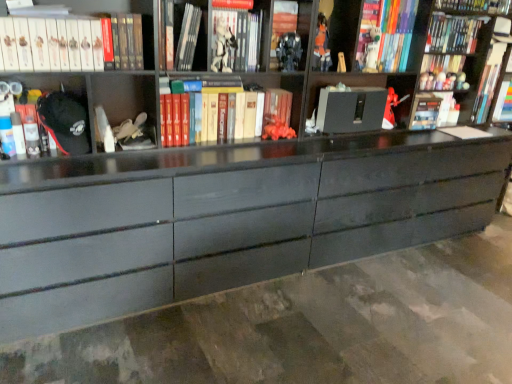
Measure the distance between point (440, 94) and camera.

They are 2.82 meters apart.

The width and height of the screenshot is (512, 384). Describe the element at coordinates (180, 35) in the screenshot. I see `hardcover book at upper left, marked as the 3th book in a left-to-right arrangement` at that location.

Looking at this image, measure the distance between point (118,21) and camera.

Point (118,21) and camera are 1.80 meters apart.

What do you see at coordinates (223, 49) in the screenshot?
I see `matte black figurine at upper center, marked as the first toy in a front-to-back arrangement` at bounding box center [223, 49].

Measure the distance between point (222,134) and camera.

A distance of 7.32 feet exists between point (222,134) and camera.

Describe the element at coordinates (426, 81) in the screenshot. This screenshot has width=512, height=384. I see `matte red figurine at upper right, which is the 5th toy from left to right` at that location.

At what (x,y) coordinates should I click in order to perform the action: click on black matte cabinet at center. Please return your answer as a coordinate pair (x, y). The width and height of the screenshot is (512, 384). Looking at the image, I should click on (361, 101).

Is hardcover book at upper left, arranged as the second book when viewed from the left, positioned beyond the bounds of hardcover book at upper center, which is the 5th book from right to left?

Indeed, hardcover book at upper left, arranged as the second book when viewed from the left, is completely outside hardcover book at upper center, which is the 5th book from right to left.

Can you confirm if hardcover book at upper left, arranged as the second book when viewed from the left, is positioned to the right of hardcover book at upper center, which is the 5th book from right to left?

No.

Based on the photo, is hardcover book at upper left, arranged as the second book when viewed from the left, positioned before hardcover book at upper center, which ranks as the 6th book in left-to-right order?

Yes, hardcover book at upper left, arranged as the second book when viewed from the left, is closer to the camera.

Are hardcover book at upper left, acting as the 9th book starting from the right, and hardcover book at upper center, which is the 5th book from right to left, beside each other?

hardcover book at upper left, acting as the 9th book starting from the right, is not next to hardcover book at upper center, which is the 5th book from right to left, and they're not touching.

From the image's perspective, which is above, matte red figurine at upper right, acting as the 7th book starting from the left, or hardcover books at center, which is counted as the 7th book, starting from the right?

From the image's view, matte red figurine at upper right, acting as the 7th book starting from the left, is above.

Is matte red figurine at upper right, the fourth book from the right, facing towards hardcover books at center, acting as the fourth book starting from the left?

No, matte red figurine at upper right, the fourth book from the right, is not oriented towards hardcover books at center, acting as the fourth book starting from the left.

Where is `the 3rd book behind the hardcover books at center, which is counted as the 7th book, starting from the right`? the 3rd book behind the hardcover books at center, which is counted as the 7th book, starting from the right is located at coordinates (434, 110).

Considering the relative sizes of matte red figurine at upper right, acting as the 7th book starting from the left, and hardcover books at center, acting as the fourth book starting from the left, in the image provided, is matte red figurine at upper right, acting as the 7th book starting from the left, wider than hardcover books at center, acting as the fourth book starting from the left,?

No.

From their relative heights in the image, would you say orange matte toy at center, the 3th toy viewed from the front, is taller or shorter than white matte book at upper left, marked as the tenth book in a right-to-left arrangement?

Considering their sizes, orange matte toy at center, the 3th toy viewed from the front, has less height than white matte book at upper left, marked as the tenth book in a right-to-left arrangement.

This screenshot has width=512, height=384. I want to click on the 3rd book above when counting from the orange matte toy at center, which appears as the third toy when viewed from the back (from the image's perspective), so click(54, 44).

Considering the sizes of objects orange matte toy at center, which appears as the third toy when viewed from the back, and white matte book at upper left, marked as the tenth book in a right-to-left arrangement, in the image provided, who is smaller, orange matte toy at center, which appears as the third toy when viewed from the back, or white matte book at upper left, marked as the tenth book in a right-to-left arrangement,?

orange matte toy at center, which appears as the third toy when viewed from the back, is smaller.

Is matte red figurine at upper right, acting as the 7th book starting from the left, a part of orange matte toy at center, which appears as the third toy when viewed from the back?

No.

Does point (288, 129) lie in front of point (455, 109)?

Yes, point (288, 129) is closer to viewer.

Does orange matte toy at center, which appears as the third toy when viewed from the back, have a smaller size compared to matte red figurine at upper right, the fourth book from the right?

Yes, orange matte toy at center, which appears as the third toy when viewed from the back, is smaller than matte red figurine at upper right, the fourth book from the right.

Is orange matte toy at center, the second toy in the left-to-right sequence, next to matte red figurine at upper right, the fourth book from the right, and touching it?

orange matte toy at center, the second toy in the left-to-right sequence, and matte red figurine at upper right, the fourth book from the right, are not in contact.

From the image's perspective, relative to hardcover book at upper right, the 3th book positioned from the right, is metallic silver robot at center, acting as the 4th toy starting from the back, above or below?

Clearly, from the image's perspective, metallic silver robot at center, acting as the 4th toy starting from the back, is below hardcover book at upper right, the 3th book positioned from the right.

Is metallic silver robot at center, acting as the 4th toy starting from the back, beside hardcover book at upper right, the 3th book positioned from the right?

No, metallic silver robot at center, acting as the 4th toy starting from the back, is not beside hardcover book at upper right, the 3th book positioned from the right.

Is metallic silver robot at center, which ranks as the third toy in right-to-left order, facing towards hardcover book at upper right, the 3th book positioned from the right?

No, metallic silver robot at center, which ranks as the third toy in right-to-left order, is not turned towards hardcover book at upper right, the 3th book positioned from the right.

Between orange matte toy at center, the fourth toy from the right, and matte red figurine at upper right, the 5th toy from the front, which one is positioned behind?

matte red figurine at upper right, the 5th toy from the front, is further from the camera.

Is orange matte toy at center, the second toy in the left-to-right sequence, inside or outside of matte red figurine at upper right, which is counted as the 1th toy, starting from the right?

orange matte toy at center, the second toy in the left-to-right sequence, is spatially situated outside matte red figurine at upper right, which is counted as the 1th toy, starting from the right.

Does orange matte toy at center, the 3th toy viewed from the front, turn towards matte red figurine at upper right, which is counted as the 1th toy, starting from the back?

No, orange matte toy at center, the 3th toy viewed from the front, does not turn towards matte red figurine at upper right, which is counted as the 1th toy, starting from the back.

Is orange matte toy at center, the fourth toy from the right, with matte red figurine at upper right, which is counted as the 1th toy, starting from the back?

They are not placed beside each other.

Is matte black desk at center completely or partially outside of metallic silver robot at center, acting as the 4th toy starting from the back?

Yes.

Could you tell me if matte black desk at center is facing metallic silver robot at center, which ranks as the third toy in right-to-left order?

Yes, matte black desk at center faces towards metallic silver robot at center, which ranks as the third toy in right-to-left order.

Which is more to the left, matte black desk at center or metallic silver robot at center, acting as the 4th toy starting from the back?

metallic silver robot at center, acting as the 4th toy starting from the back.

Which of these two, matte black desk at center or metallic silver robot at center, which ranks as the third toy in right-to-left order, is thinner?

With smaller width is metallic silver robot at center, which ranks as the third toy in right-to-left order.

Where is `book that is the 4th one when counting downward from the hardcover book at upper center, which is the 5th book from right to left (from the image's perspective)`? The image size is (512, 384). book that is the 4th one when counting downward from the hardcover book at upper center, which is the 5th book from right to left (from the image's perspective) is located at coordinates (123, 40).

From the matte red figurine at upper right, the fourth book from the right, count 3rd books forward and point to it. Please provide its 2D coordinates.

[(225, 112)]

Looking at this image, based on their spatial positions, is matte black figurine at upper center, which is the fifth toy from right to left, or hardcover book at upper left, the eighth book viewed from the right, further from hardcover book at upper center, which is the 5th book from right to left?

The object further to hardcover book at upper center, which is the 5th book from right to left, is hardcover book at upper left, the eighth book viewed from the right.

From the image, which object appears to be nearer to metallic silver robot at center, which is the third toy from left to right, black matte cabinet at center or matte plastic toy at upper right, which appears as the fourth toy when viewed from the front?

The object closer to metallic silver robot at center, which is the third toy from left to right, is black matte cabinet at center.

Looking at the image, which one is located further to matte plastic toy at upper right, the fourth toy in the left-to-right sequence, white matte book at upper left, marked as the tenth book in a right-to-left arrangement, or matte black desk at center?

Based on the image, white matte book at upper left, marked as the tenth book in a right-to-left arrangement, appears to be further to matte plastic toy at upper right, the fourth toy in the left-to-right sequence.

When comparing their distances from hardcover book at upper left, arranged as the second book when viewed from the left, does orange matte toy at center, the second toy in the left-to-right sequence, or hardcover book at upper right, the 3th book positioned from the right, seem further?

hardcover book at upper right, the 3th book positioned from the right, is positioned further to the anchor hardcover book at upper left, arranged as the second book when viewed from the left.

Based on their spatial positions, is hardcover book at upper center, which ranks as the 6th book in left-to-right order, or matte black figurine at upper center, marked as the first toy in a front-to-back arrangement, further from orange matte toy at center, the fourth toy from the right?

hardcover book at upper center, which ranks as the 6th book in left-to-right order, lies further to orange matte toy at center, the fourth toy from the right, than the other object.

Based on the photo, which object lies further to the anchor point metallic silver robot at center, which ranks as the third toy in right-to-left order, hardcover books at center, which is counted as the 7th book, starting from the right, or hardcover book at upper left, marked as the 3th book in a left-to-right arrangement?

hardcover book at upper left, marked as the 3th book in a left-to-right arrangement, is positioned further to the anchor metallic silver robot at center, which ranks as the third toy in right-to-left order.

Consider the image. Estimate the real-world distances between objects in this image. Which object is closer to hardcover book at upper center, which is the 5th book from right to left, hardcover book at upper right, the 3th book positioned from the right, or orange matte toy at center, the second toy in the left-to-right sequence?

The object closer to hardcover book at upper center, which is the 5th book from right to left, is orange matte toy at center, the second toy in the left-to-right sequence.

Estimate the real-world distances between objects in this image. Which object is further from hardcover book at upper right, the 10th book positioned from the left, white matte book at upper left, marked as the tenth book in a right-to-left arrangement, or hardcover book at upper right, the 3th book positioned from the right?

white matte book at upper left, marked as the tenth book in a right-to-left arrangement, is further to hardcover book at upper right, the 10th book positioned from the left.

You are a GUI agent. You are given a task and a screenshot of the screen. Output one action in this format:
    pyautogui.click(x=<x>, y=<y>)
    Task: Click on the computer desk situated between white matte book at upper left, marked as the tenth book in a right-to-left arrangement, and hardcover book at upper right, the 10th book positioned from the left, from left to right
    The width and height of the screenshot is (512, 384).
    Given the screenshot: What is the action you would take?
    pyautogui.click(x=225, y=218)

Image resolution: width=512 pixels, height=384 pixels. I want to click on cabinet between hardcover book at upper center, which ranks as the 6th book in left-to-right order, and matte red figurine at upper right, which is counted as the 1th toy, starting from the right, in the horizontal direction, so click(x=361, y=101).

Locate an element on the screen. cabinet located between hardcover books at center, which is counted as the 7th book, starting from the right, and matte red figurine at upper right, the fourth book from the right, in the left-right direction is located at coordinates (361, 101).

The height and width of the screenshot is (384, 512). Find the location of `computer desk situated between matte black figurine at upper center, marked as the first toy in a front-to-back arrangement, and hardcover book at upper right, which is counted as the first book, starting from the right, from left to right`. computer desk situated between matte black figurine at upper center, marked as the first toy in a front-to-back arrangement, and hardcover book at upper right, which is counted as the first book, starting from the right, from left to right is located at coordinates (225, 218).